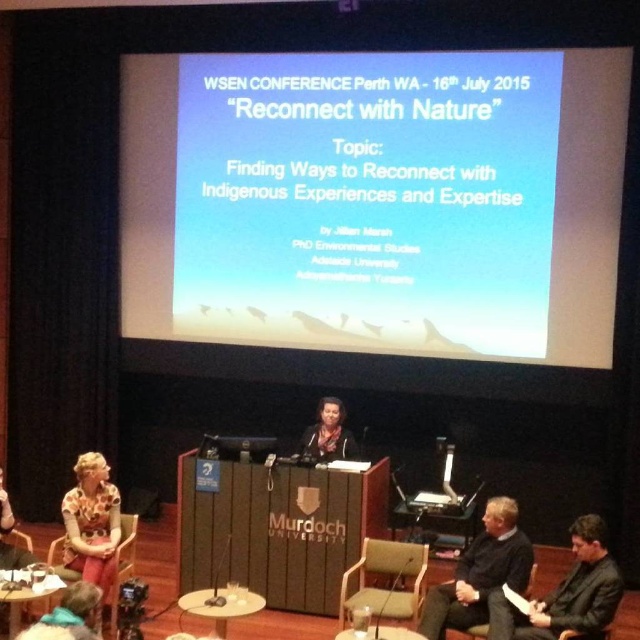
Which is in front, point (484, 616) or point (396, 547)?

Point (484, 616) is in front.

Is point (493, 545) less distant than point (412, 586)?

Yes, it is in front of point (412, 586).

Who is more distant from viewer, (x=513, y=561) or (x=381, y=561)?

Point (x=381, y=561)

At what (x,y) coordinates should I click in order to perform the action: click on black fabric jacket at lower right. Please return your answer as a coordinate pair (x, y). Looking at the image, I should click on (480, 572).

Does wooden round table at lower left have a lesser width compared to black leather chair at lower right?

No.

Which is behind, point (17, 595) or point (576, 632)?

Positioned behind is point (17, 595).

This screenshot has width=640, height=640. I want to click on wooden round table at lower left, so tap(22, 595).

Between floral fabric dress at lower left and wooden round table at center, which one appears on the right side from the viewer's perspective?

wooden round table at center is more to the right.

What do you see at coordinates (92, 522) in the screenshot? This screenshot has height=640, width=640. I see `floral fabric dress at lower left` at bounding box center [92, 522].

I want to click on floral fabric dress at lower left, so click(x=92, y=522).